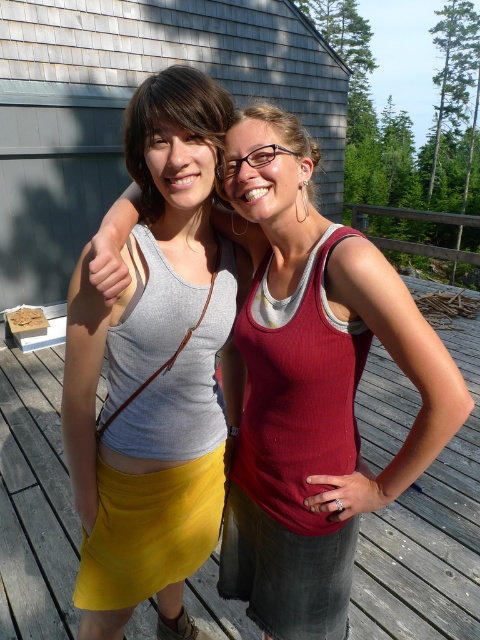
Question: Which object is farther from the camera taking this photo?

Choices:
 (A) yellow fabric skirt at center
 (B) gray matte tank top at center

Answer: (A)

Question: Which object is closer to the camera taking this photo?

Choices:
 (A) gray matte tank top at center
 (B) matte gray tank top at center
 (C) yellow fabric skirt at center

Answer: (B)

Question: Among these objects, which one is farthest from the camera?

Choices:
 (A) gray matte tank top at center
 (B) yellow fabric skirt at center

Answer: (B)

Question: Does yellow fabric skirt at center have a greater width compared to matte gray tank top at center?

Choices:
 (A) yes
 (B) no

Answer: (A)

Question: Does yellow fabric skirt at center appear over matte gray tank top at center?

Choices:
 (A) yes
 (B) no

Answer: (B)

Question: Does yellow fabric skirt at center have a smaller size compared to matte gray tank top at center?

Choices:
 (A) yes
 (B) no

Answer: (B)